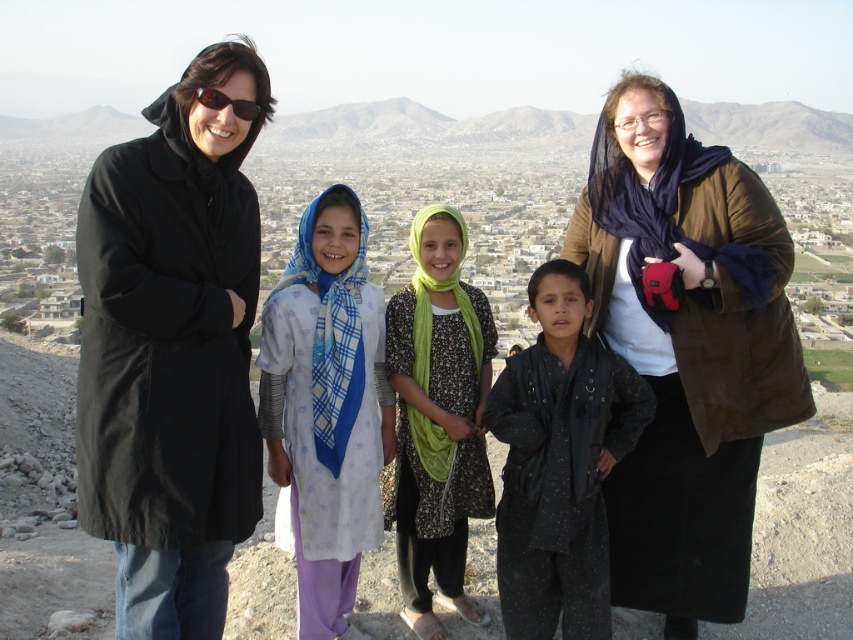
Is point (743, 401) positioned behind point (355, 580)?

No, it is not.

Based on the photo, between brown suede jacket at upper right and light purple fabric dress at center, which one is positioned higher?

brown suede jacket at upper right is higher up.

Is point (674, 218) positioned before point (347, 634)?

That is False.

You are a GUI agent. You are given a task and a screenshot of the screen. Output one action in this format:
    pyautogui.click(x=<x>, y=<y>)
    Task: Click on the brown suede jacket at upper right
    
    Given the screenshot: What is the action you would take?
    pyautogui.click(x=686, y=349)

Who is positioned more to the right, black fabric coat at left or brown suede jacket at upper right?

brown suede jacket at upper right is more to the right.

What do you see at coordinates (173, 348) in the screenshot? Image resolution: width=853 pixels, height=640 pixels. I see `black fabric coat at left` at bounding box center [173, 348].

The image size is (853, 640). Find the location of `black fabric coat at left`. black fabric coat at left is located at coordinates (173, 348).

Which is more to the left, brown suede jacket at upper right or black textured jacket at center?

Positioned to the left is black textured jacket at center.

Does brown suede jacket at upper right appear on the left side of black textured jacket at center?

In fact, brown suede jacket at upper right is to the right of black textured jacket at center.

Image resolution: width=853 pixels, height=640 pixels. Find the location of `brown suede jacket at upper right`. brown suede jacket at upper right is located at coordinates click(686, 349).

Where is `brown suede jacket at upper right`? This screenshot has width=853, height=640. brown suede jacket at upper right is located at coordinates (686, 349).